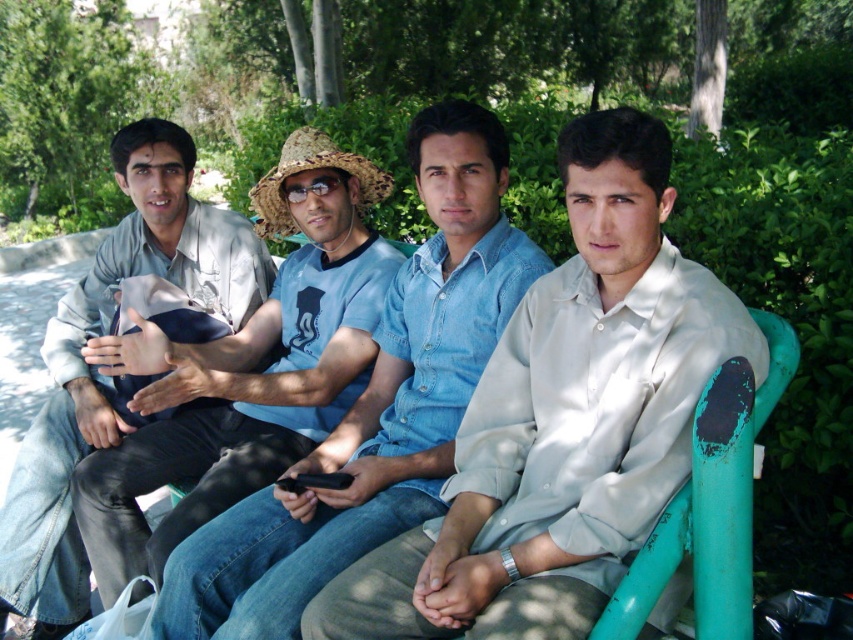
Question: Does denim shirt at center lie behind light beige shirt at left?

Choices:
 (A) yes
 (B) no

Answer: (B)

Question: Which point is farther to the camera?

Choices:
 (A) strawmaterial/texturehat at center
 (B) denim shirt at center
 (C) light beige shirt at left
 (D) matte blue shirt at center

Answer: (C)

Question: Among these objects, which one is nearest to the camera?

Choices:
 (A) light blue denim shirt at center
 (B) strawmaterial/texturehat at center

Answer: (A)

Question: Does light blue denim shirt at center appear under matte blue shirt at center?

Choices:
 (A) yes
 (B) no

Answer: (A)

Question: Based on their relative distances, which object is farther from the strawmaterial/texturehat at center?

Choices:
 (A) matte blue shirt at center
 (B) light blue denim shirt at center
 (C) light beige shirt at left

Answer: (B)

Question: Does light blue denim shirt at center appear over denim shirt at center?

Choices:
 (A) no
 (B) yes

Answer: (A)